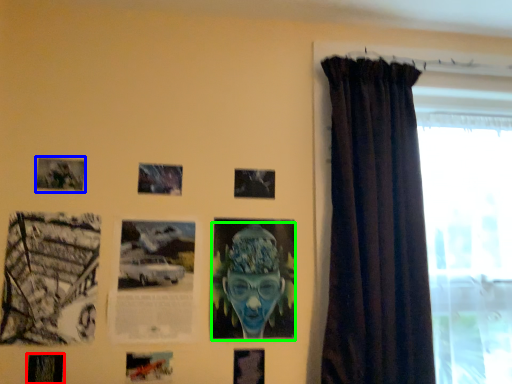
Question: Considering the real-world distances, which object is closest to picture frame (highlighted by a red box)? picture frame (highlighted by a blue box) or person (highlighted by a green box).

Choices:
 (A) picture frame
 (B) person

Answer: (A)